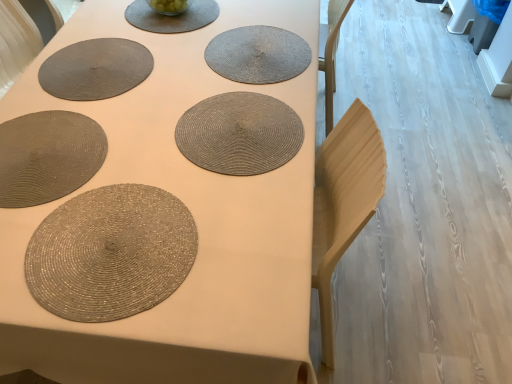
Image resolution: width=512 pixels, height=384 pixels. What are the coordinates of `free space between matte gray placemat at upper center and matte gray placemat at upper left, which appears as the first paper plate when viewed from the top` in the screenshot? It's located at (140, 46).